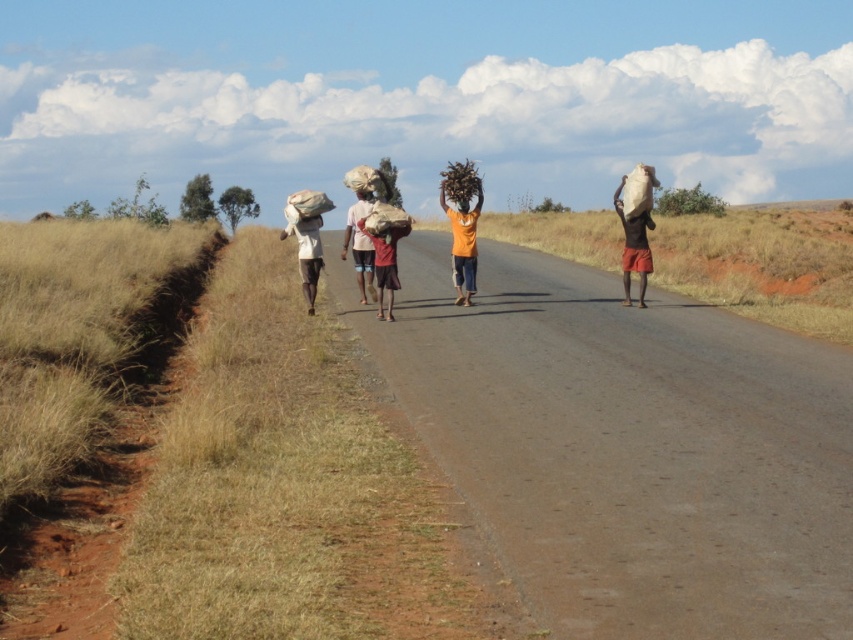
You are a photographer trying to capture a photo of the orange matte shirt at center and the matte brown bag at right. Which object should you focus on first if you want to ensure both are in the frame without moving the camera?

You should focus on the orange matte shirt at center first because it is shorter than the matte brown bag at right, so you can adjust the camera angle to include both by framing from the bottom up.

You are a photographer trying to capture a group photo of the orange matte shirt at center and the smooth brown head at center. Given that your camera has a fixed focus range that can only accommodate objects of the same width, will you need to adjust the framing to ensure both fit properly?

The orange matte shirt at center is wider than the smooth brown head at center, so you will need to adjust the framing to ensure both fit properly within the camera focus range.

You are a photographer trying to capture a group photo of the orange matte shirt at center and the smooth brown head at center. Which person should you focus on first if you want to ensure they are in focus, considering their heights?

The orange matte shirt at center is much taller than the smooth brown head at center, so you should focus on the orange matte shirt at center first to ensure proper focus.